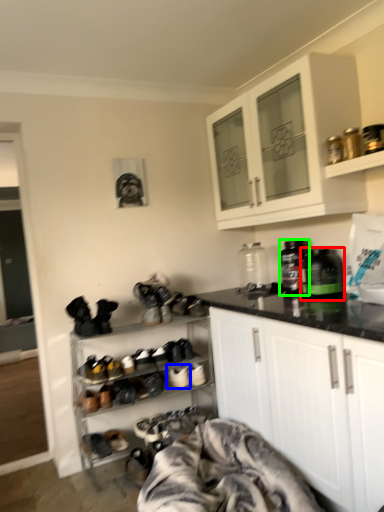
Question: Which object is positioned closest to bottle (highlighted by a red box)? Select from footwear (highlighted by a blue box) and bottle (highlighted by a green box).

Choices:
 (A) footwear
 (B) bottle

Answer: (B)